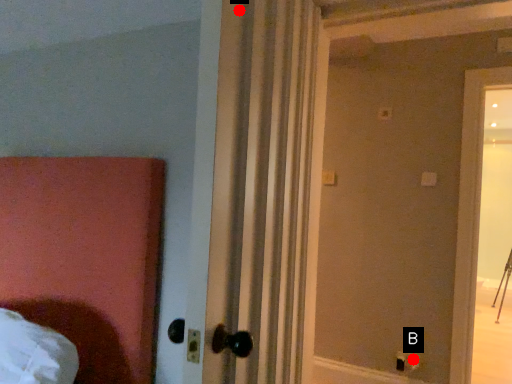
Question: Two points are circled on the image, labeled by A and B beside each circle. Which point is closer to the camera?

Choices:
 (A) A is closer
 (B) B is closer

Answer: (A)